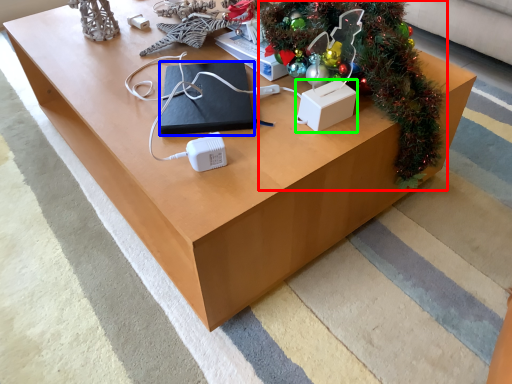
Question: Based on their relative distances, which object is nearer to christmas tree (highlighted by a red box)? Choose from pad (highlighted by a blue box) and box (highlighted by a green box).

Choices:
 (A) pad
 (B) box

Answer: (B)